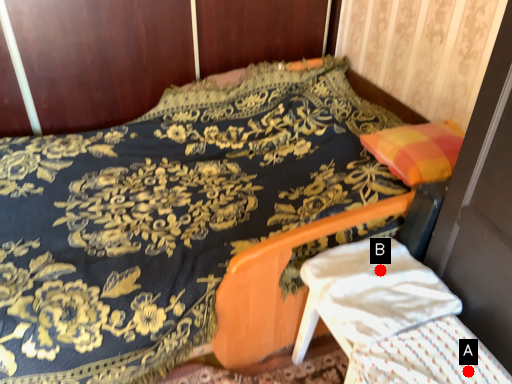
Question: Two points are circled on the image, labeled by A and B beside each circle. Which of the following is the closest to the observer?

Choices:
 (A) A is closer
 (B) B is closer

Answer: (A)